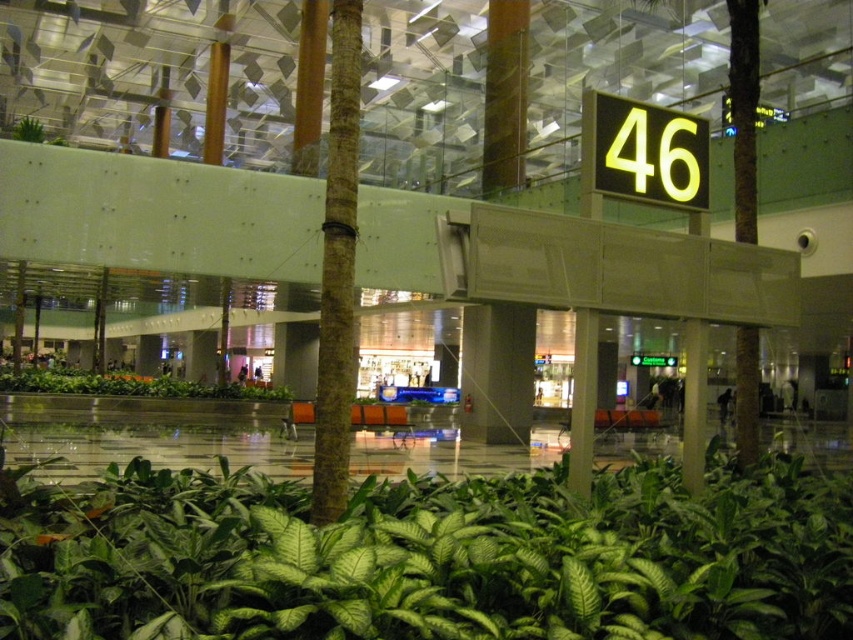
Question: From the image, what is the correct spatial relationship of brown textured pillar at center in relation to green leafy plants at center?

Choices:
 (A) right
 (B) left

Answer: (A)

Question: Based on their relative distances, which object is farther from the green leafy plant at center?

Choices:
 (A) green leafy plants at center
 (B) brown textured pillar at center

Answer: (A)

Question: Is brown textured pillar at center above green leafy plants at center?

Choices:
 (A) yes
 (B) no

Answer: (A)

Question: Among these objects, which one is farthest from the camera?

Choices:
 (A) green leafy plants at center
 (B) brown textured pillar at center
 (C) green leafy plant at center

Answer: (A)

Question: Is green leafy plant at center to the right of green leafy plants at center from the viewer's perspective?

Choices:
 (A) yes
 (B) no

Answer: (A)

Question: Among these points, which one is nearest to the camera?

Choices:
 (A) (259, 388)
 (B) (126, 611)
 (C) (352, 92)

Answer: (B)